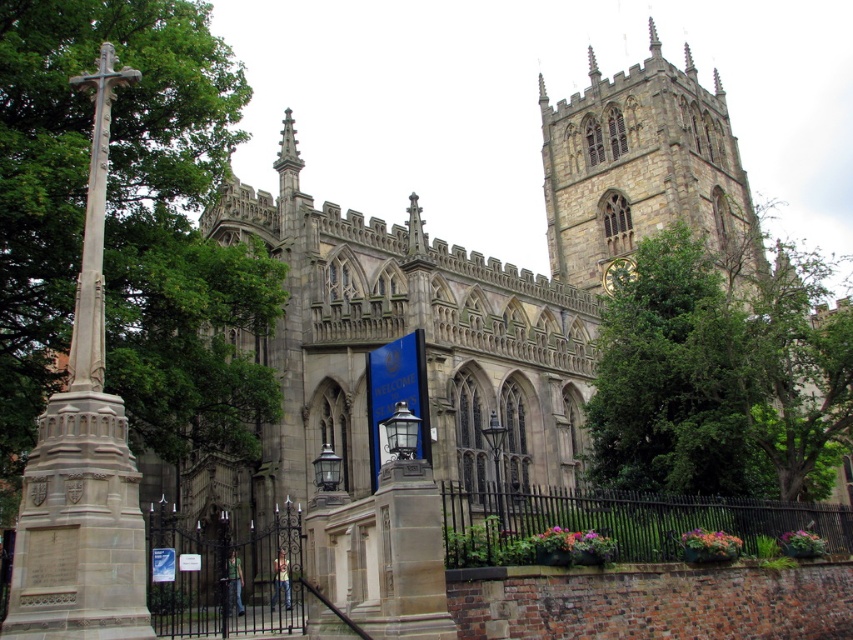
You are a tourist standing in front of the grand Gothic church. You notice the stone clock tower at upper center and the gold metallic clock at upper right. Which of these two objects appears bigger in the image?

The stone clock tower at upper center appears bigger than the gold metallic clock at upper right in the image.

You are standing at the entrance of the grand Gothic church and want to take a photo of the green leafy tree at center. Where should you position yourself to capture the tree in the frame?

The green leafy tree at center is located at point coordinates (674, 380), so you should position yourself directly in front of the tree to capture it in the frame.